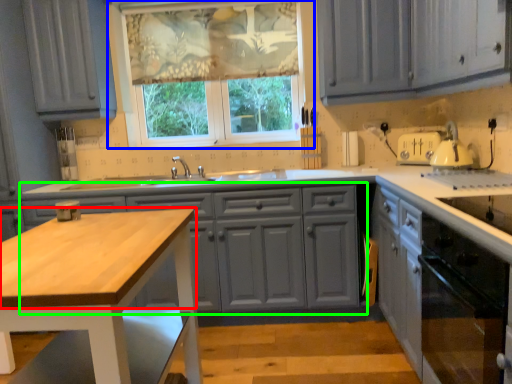
Question: Estimate the real-world distances between objects in this image. Which object is closer to countertop (highlighted by a red box), window (highlighted by a blue box) or cabinetry (highlighted by a green box)?

Choices:
 (A) window
 (B) cabinetry

Answer: (B)